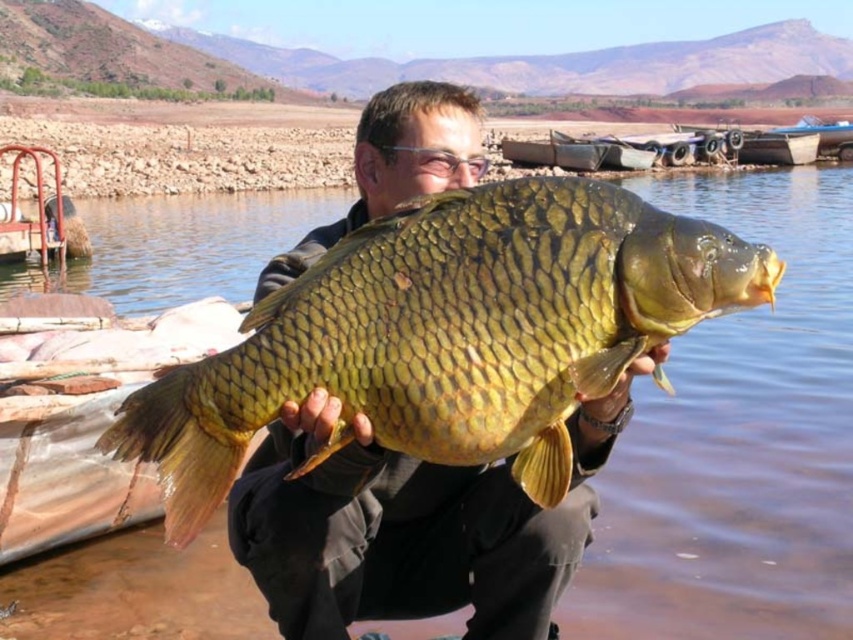
Question: Where is shiny gold scales at center located in relation to green scaly fish at center in the image?

Choices:
 (A) below
 (B) above

Answer: (B)

Question: Is shiny gold scales at center thinner than green scaly fish at center?

Choices:
 (A) yes
 (B) no

Answer: (B)

Question: Which point is closer to the camera taking this photo?

Choices:
 (A) (262, 296)
 (B) (445, 321)

Answer: (B)

Question: Is shiny gold scales at center to the left of green scaly fish at center from the viewer's perspective?

Choices:
 (A) yes
 (B) no

Answer: (A)